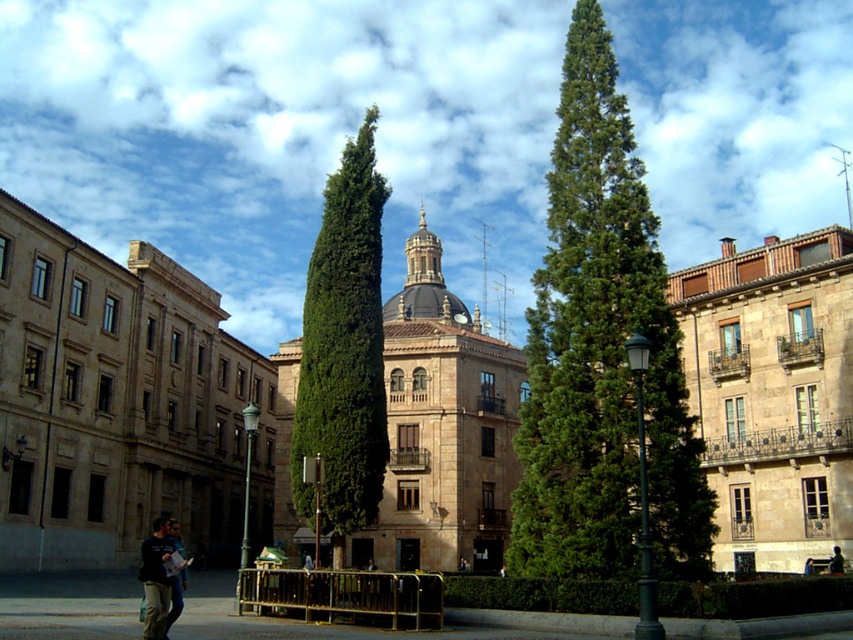
You are standing at the point labeled point (343, 353) in the image. What is the nearest object to you?

The nearest object to you is the green leafy tree at center, as the point (343, 353) is located on it.

You are a delivery person holding a blue fabric bag at center and need to pass through a narrow doorway next to a green leafy tree at center. Can you fit through the doorway without squeezing?

The green leafy tree at center is wider than the blue fabric bag at center. Since the tree is already positioned next to the doorway, it might block or reduce the available space. Therefore, the blue fabric bag at center should fit through the doorway, but the presence of the wider tree could make it difficult to pass without squeezing.

You are a delivery person who needs to place a blue fabric bag at center on the ground without blocking the view of the green leafy tree at center. Can you do this?

The green leafy tree at center is larger in size than the blue fabric bag at center, so placing the blue fabric bag at center on the ground should not block the view of the tree since the tree is bigger.